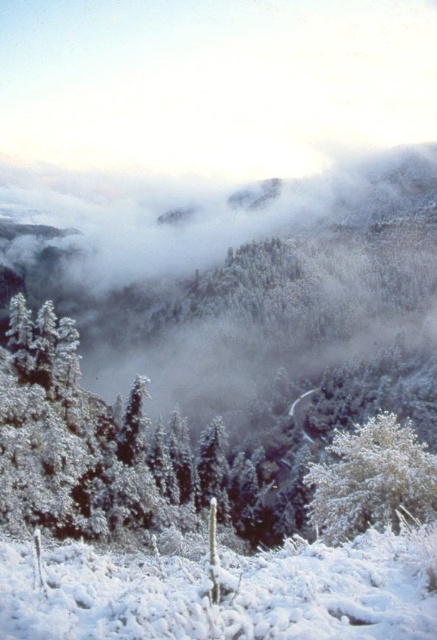
Question: Which of the following is the farthest from the observer?

Choices:
 (A) (4, 577)
 (B) (392, 419)

Answer: (B)

Question: From the image, what is the correct spatial relationship of white fluffy snow at lower center in relation to white frosty tree at lower right?

Choices:
 (A) right
 (B) left

Answer: (B)

Question: Which object is closer to the camera taking this photo?

Choices:
 (A) white fluffy snow at lower center
 (B) white frosty tree at lower right

Answer: (A)

Question: Is white fluffy snow at lower center wider than white frosty tree at lower right?

Choices:
 (A) yes
 (B) no

Answer: (B)

Question: In this image, where is white fluffy snow at lower center located relative to white frosty tree at lower right?

Choices:
 (A) right
 (B) left

Answer: (B)

Question: Which of the following is the closest to the observer?

Choices:
 (A) (337, 474)
 (B) (0, 605)

Answer: (B)